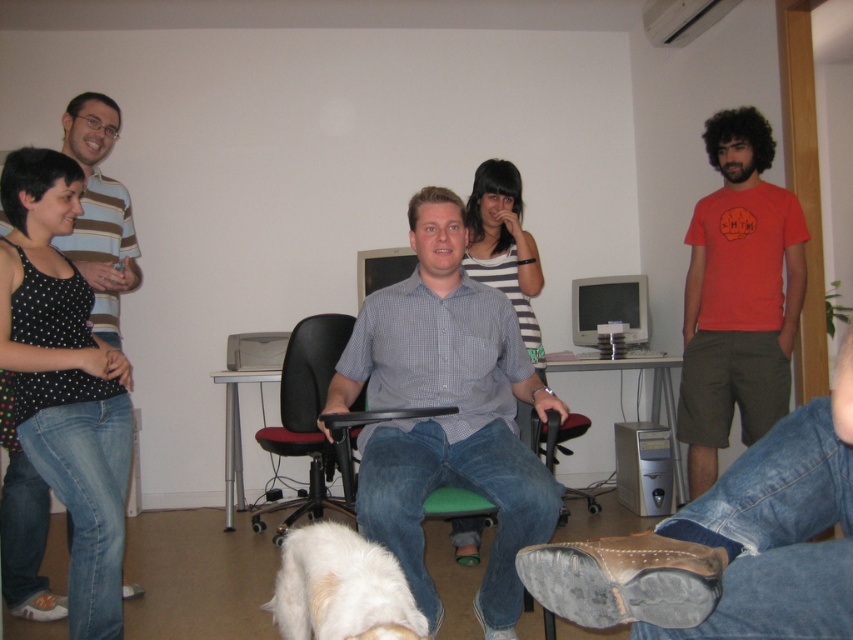
Question: Which object is farther from the camera taking this photo?

Choices:
 (A) white fluffy dog at lower center
 (B) checkered shirt at center
 (C) striped cotton shirt at left
 (D) striped fabric dress at center

Answer: (C)

Question: Is checkered shirt at center positioned in front of striped cotton shirt at left?

Choices:
 (A) yes
 (B) no

Answer: (A)

Question: Which point is closer to the camera taking this photo?

Choices:
 (A) (492, 268)
 (B) (769, 216)
 (C) (410, 330)

Answer: (C)

Question: From the image, what is the correct spatial relationship of white fluffy dog at lower center in relation to striped fabric dress at center?

Choices:
 (A) below
 (B) above

Answer: (A)

Question: Which of the following is the closest to the observer?

Choices:
 (A) checkered shirt at center
 (B) black leather swivel chair at center
 (C) striped cotton shirt at left
 (D) orange cotton t-shirt at right

Answer: (A)

Question: Is checkered shirt at center to the right of white fluffy dog at lower center from the viewer's perspective?

Choices:
 (A) yes
 (B) no

Answer: (A)